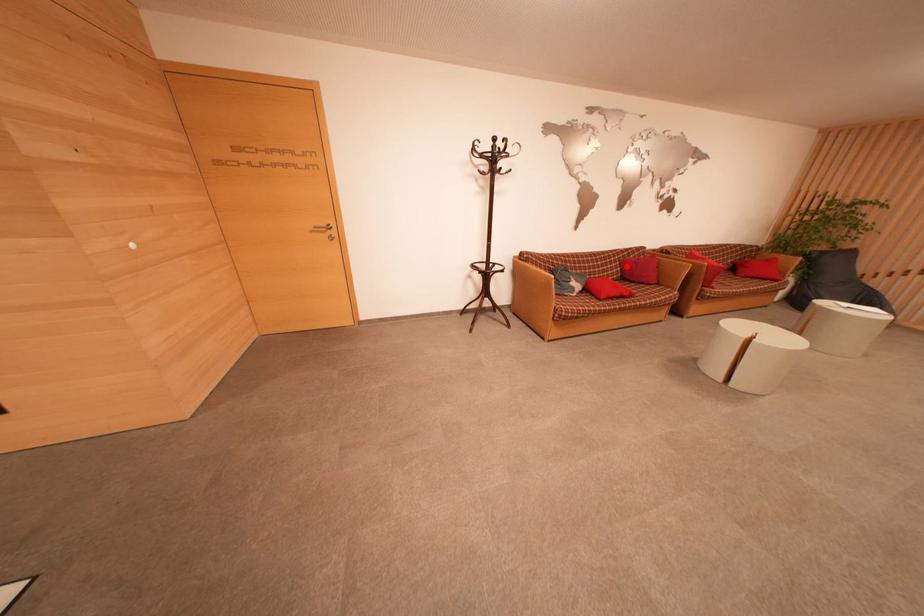
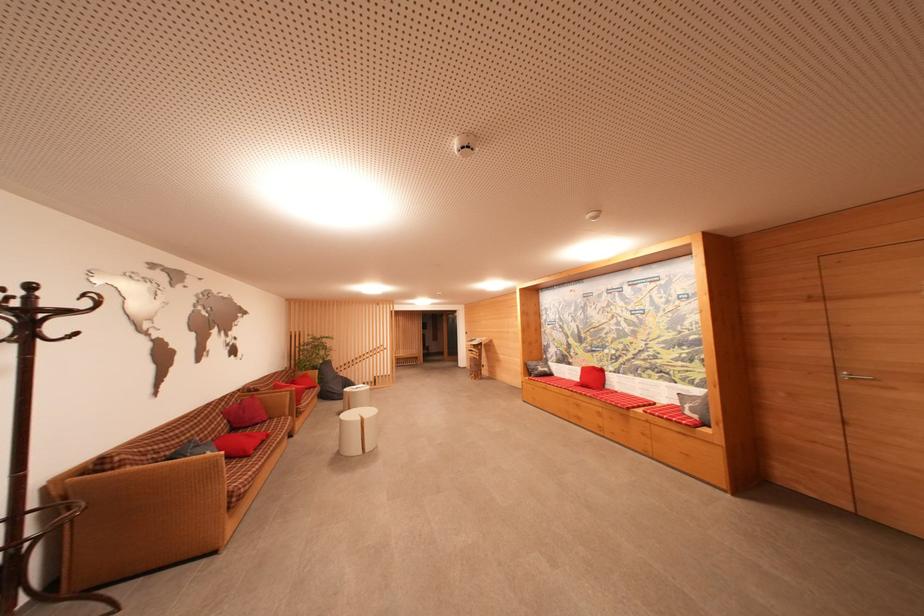
Where in the second image is the point corresponding to the highlighted location from the first image?

(231, 416)